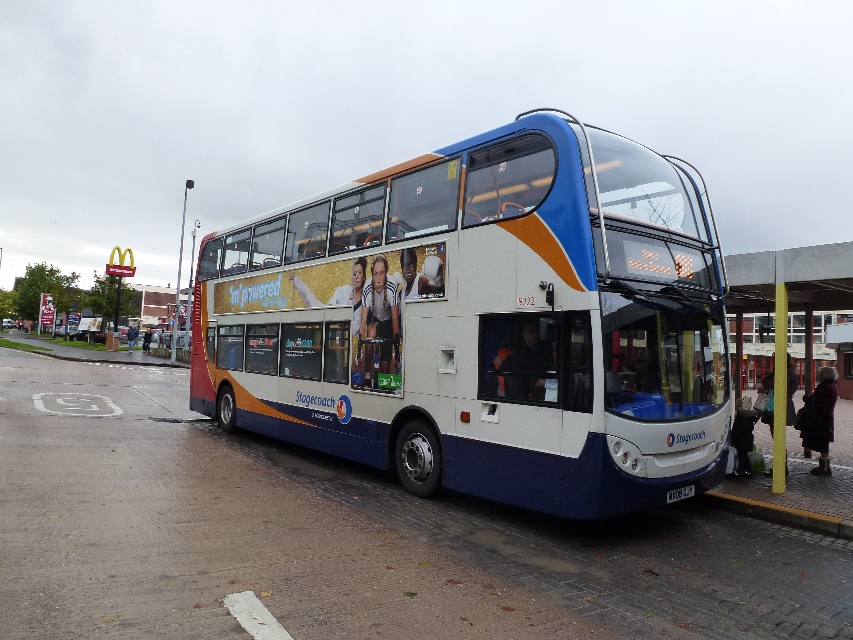
You are a pedestrian standing at the bus stop. You see the white glossy decker bus at center and the white plastic license plate at lower center. Which object is larger in size?

The white glossy decker bus at center is bigger than the white plastic license plate at lower center.

You are a pedestrian standing at the bus stop. You see the white glossy decker bus at center and the white plastic license plate at lower center. Which object is closer to the left side of the bus stop?

The white glossy decker bus at center is to the left of the white plastic license plate at lower center, so the white glossy decker bus at center is closer to the left side of the bus stop.

You are a pedestrian standing at the bus stop. You want to read the license plate on the bus. Is the white glossy decker bus at center blocking your view of the white plastic license plate at lower center?

The white glossy decker bus at center is closer to the viewer than the white plastic license plate at lower center, so the bus is blocking the view of the license plate.